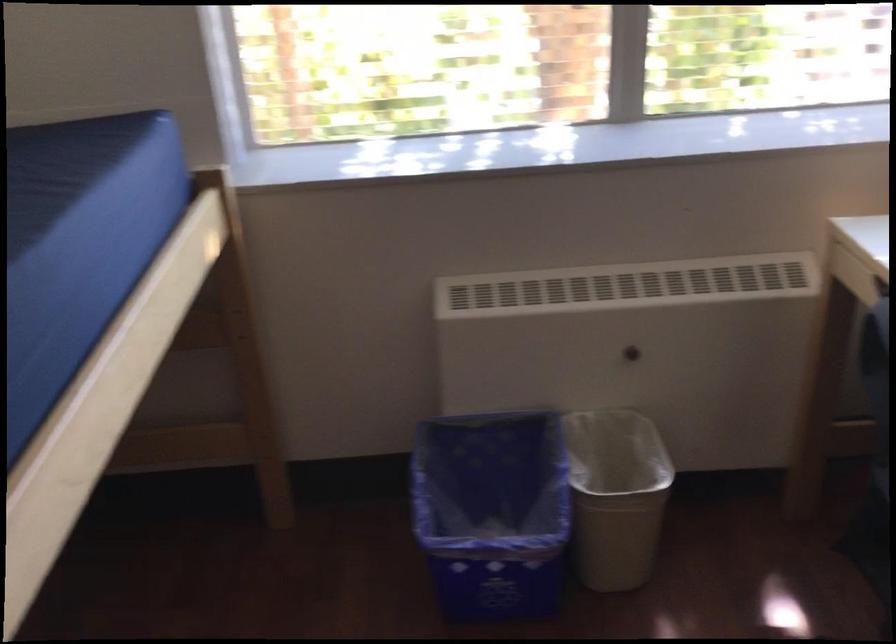
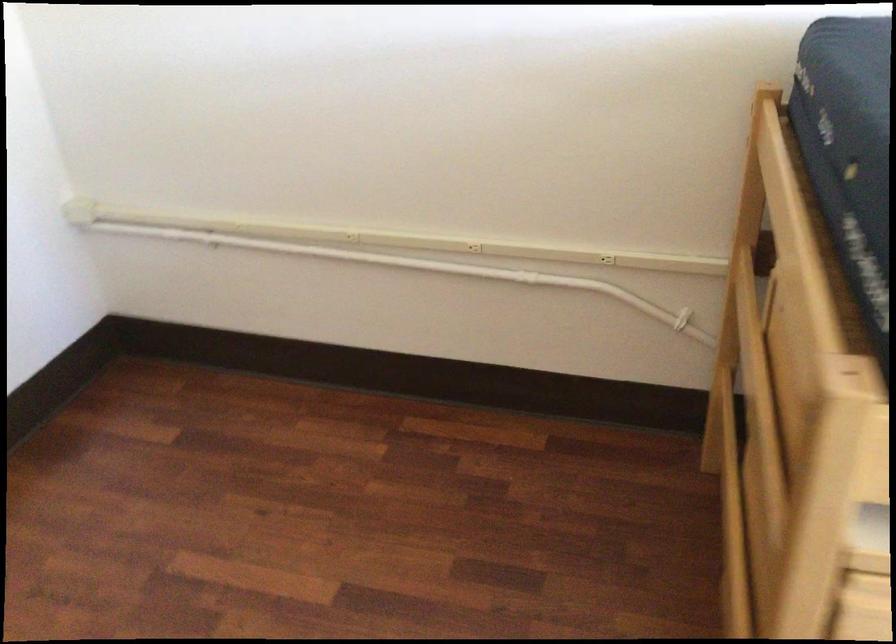
In the scene shown: How did the camera likely rotate?

The rotation direction of the camera is left-down.